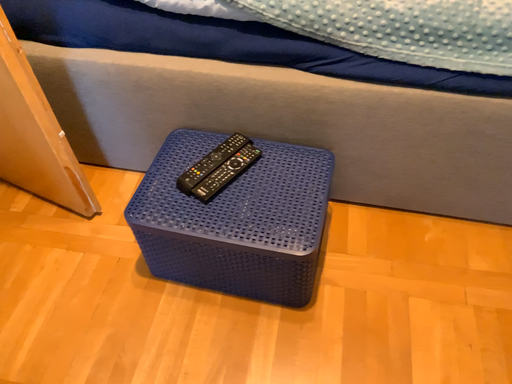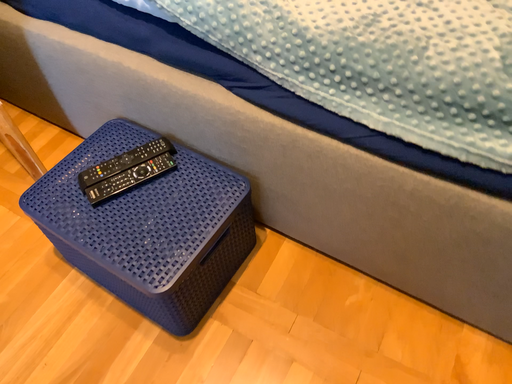
Question: Which way did the camera rotate in the video?

Choices:
 (A) rotated right
 (B) rotated left

Answer: (B)